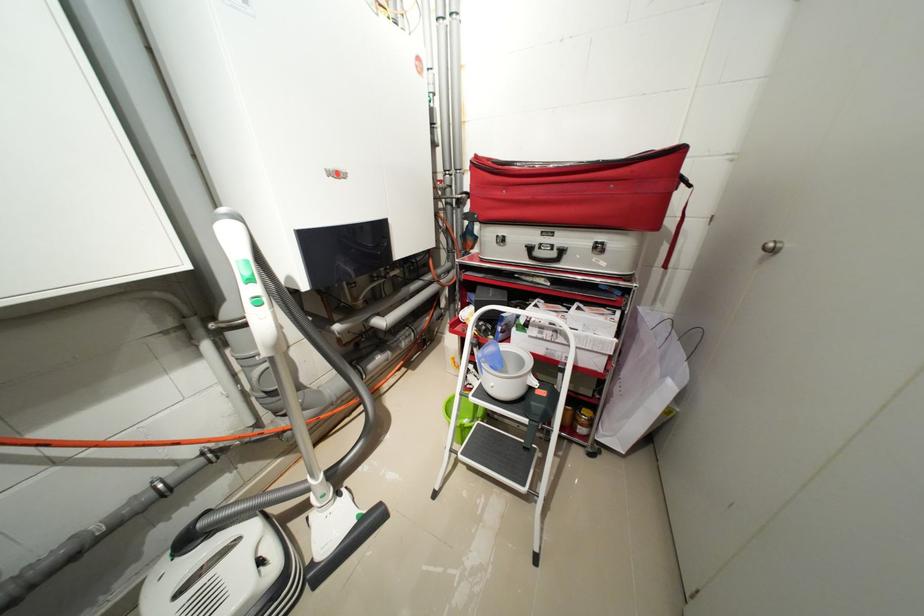
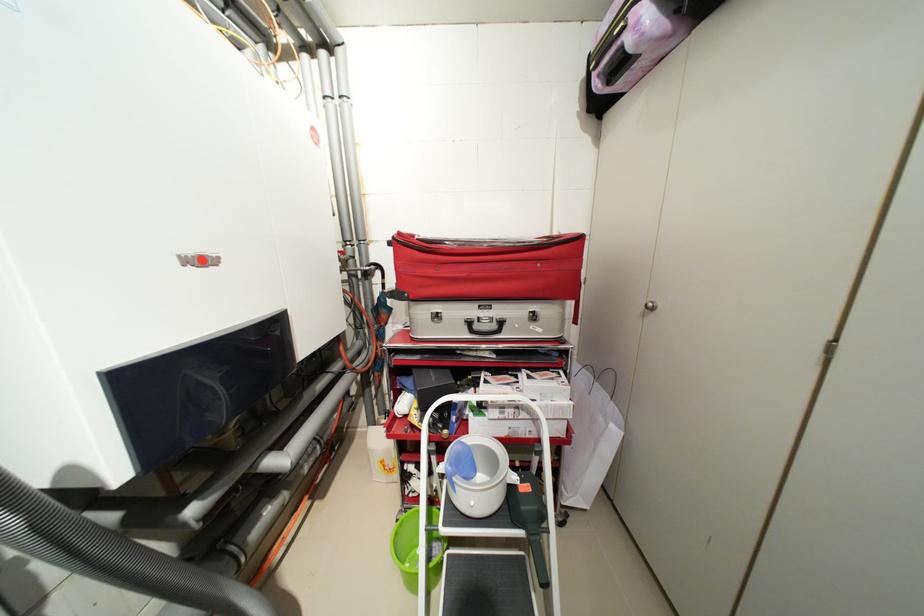
Find the pixel in the second image that matches (488,368) in the first image.

(459, 485)